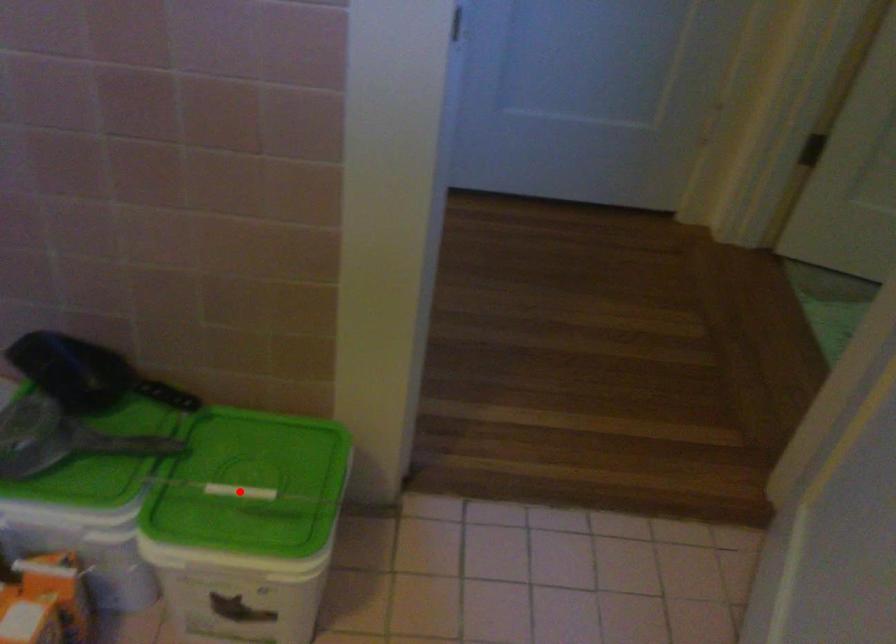
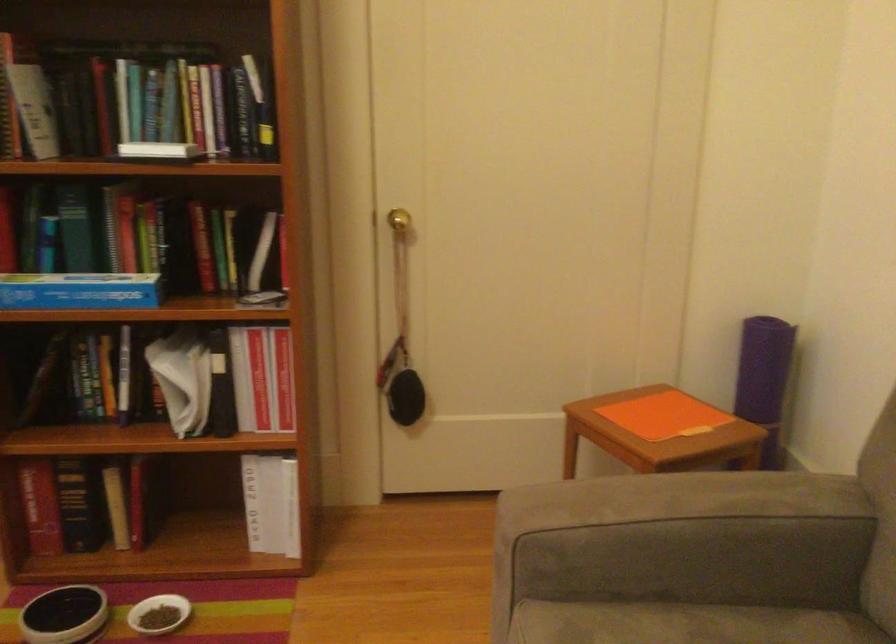
Question: I am providing you with two images of the same scene from different viewpoints. A red point is marked on the first image. Can you still see the location of the red point in image 2?

Choices:
 (A) Yes
 (B) No

Answer: (B)